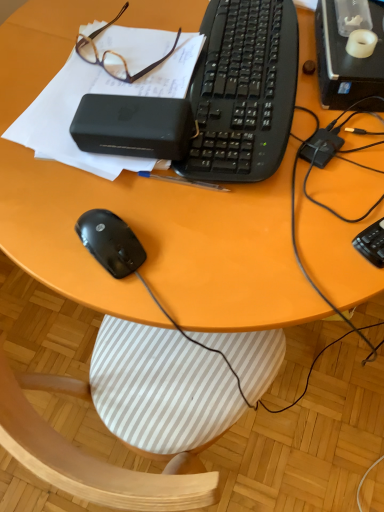
Identify the location of vacant area that lies between black matte mouse at lower left and black matte notepad at upper left. [x=98, y=201].